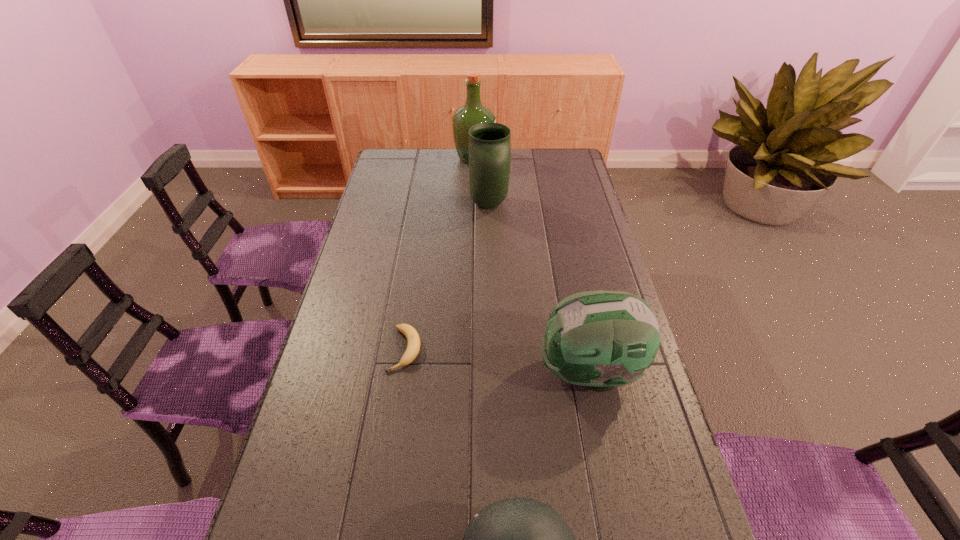
The height and width of the screenshot is (540, 960). Identify the location of the farthest object. (473, 112).

You are a GUI agent. You are given a task and a screenshot of the screen. Output one action in this format:
    pyautogui.click(x=<x>, y=<y>)
    Task: Click on the liquor
    This screenshot has width=960, height=540.
    Given the screenshot: What is the action you would take?
    pyautogui.click(x=473, y=112)

Find the location of a particular element. vase is located at coordinates (489, 143).

Image resolution: width=960 pixels, height=540 pixels. In order to click on the taller football helmet in this screenshot , I will do `click(600, 339)`.

Where is `the farther football helmet`? The height and width of the screenshot is (540, 960). the farther football helmet is located at coordinates (600, 339).

Identify the location of banana. (411, 334).

Where is `the leftmost object`? The image size is (960, 540). the leftmost object is located at coordinates click(x=411, y=334).

Image resolution: width=960 pixels, height=540 pixels. What are the coordinates of `free space located 0.180m on the front-facing side of the tallest object` in the screenshot? It's located at (534, 158).

The height and width of the screenshot is (540, 960). I want to click on vacant space situated on the left of the vase, so click(399, 204).

The width and height of the screenshot is (960, 540). I want to click on vacant space positioned on the visor of the taller football helmet, so click(x=413, y=372).